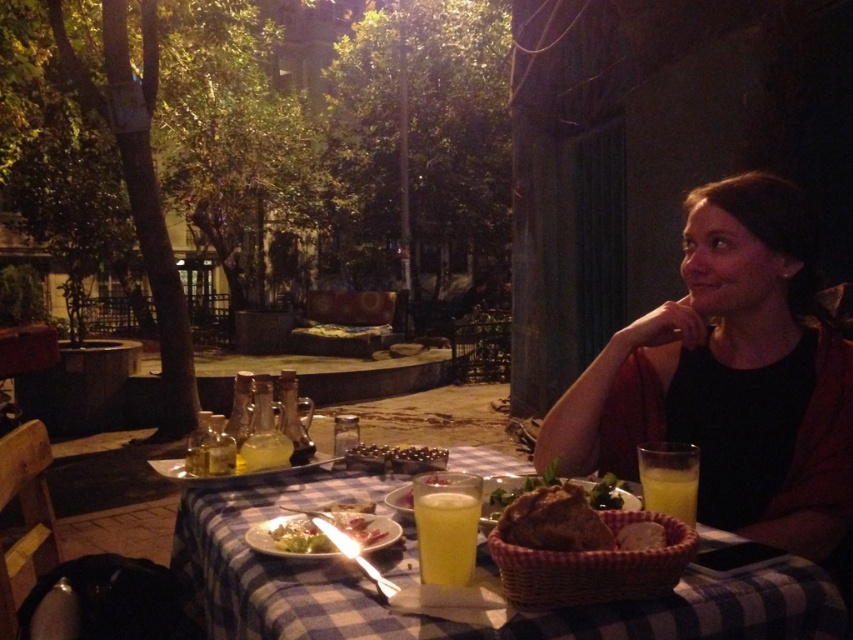
Is point (767, 384) more distant than point (451, 573)?

Yes.

Between black matte shirt at center and yellow translucent glass at table center, which one appears on the left side from the viewer's perspective?

yellow translucent glass at table center is more to the left.

The width and height of the screenshot is (853, 640). Find the location of `black matte shirt at center`. black matte shirt at center is located at coordinates (730, 378).

Between yellow translucent glass at table center and matte white plate with salad at center, which one has less height?

matte white plate with salad at center

Between yellow translucent glass at table center and matte white plate with salad at center, which one appears on the left side from the viewer's perspective?

matte white plate with salad at center is more to the left.

Who is more forward, (432, 497) or (389, 540)?

Positioned in front is point (432, 497).

I want to click on yellow translucent glass at table center, so click(445, 525).

Who is shorter, black matte shirt at center or matte white plate with salad at center?

Standing shorter between the two is matte white plate with salad at center.

Is black matte shirt at center thinner than matte white plate with salad at center?

No, black matte shirt at center is not thinner than matte white plate with salad at center.

Does point (811, 296) come in front of point (338, 525)?

No, it is not.

Image resolution: width=853 pixels, height=640 pixels. Identify the location of black matte shirt at center. (730, 378).